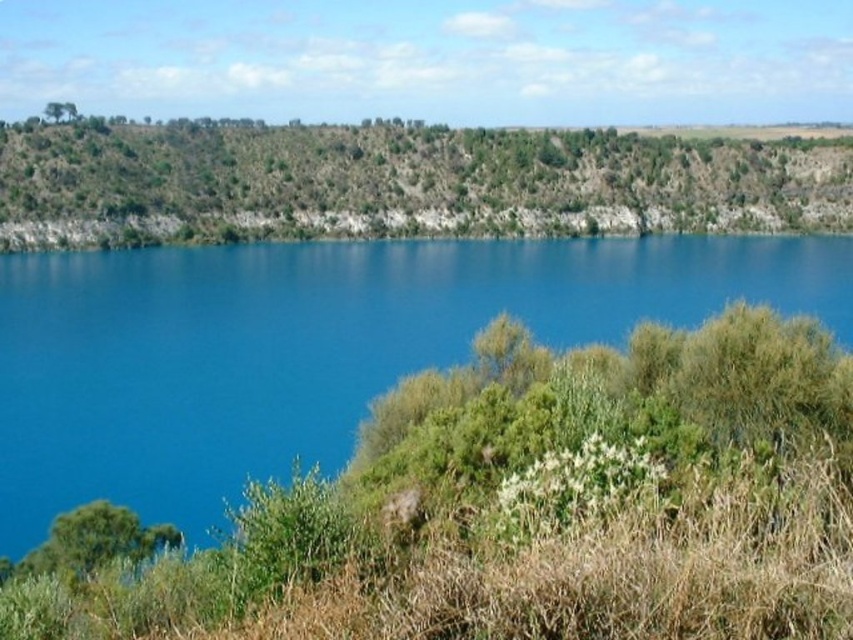
Question: Among these points, which one is farthest from the camera?

Choices:
 (A) (666, 244)
 (B) (229, 147)

Answer: (B)

Question: Among these points, which one is nearest to the camera?

Choices:
 (A) (143, 480)
 (B) (363, 140)

Answer: (A)

Question: Considering the relative positions of blue water at center and green grassy hillside at upper center in the image provided, where is blue water at center located with respect to green grassy hillside at upper center?

Choices:
 (A) below
 (B) above

Answer: (A)

Question: Does blue water at center have a larger size compared to green grassy hillside at upper center?

Choices:
 (A) yes
 (B) no

Answer: (B)

Question: Is blue water at center closer to the viewer compared to green grassy hillside at upper center?

Choices:
 (A) no
 (B) yes

Answer: (B)